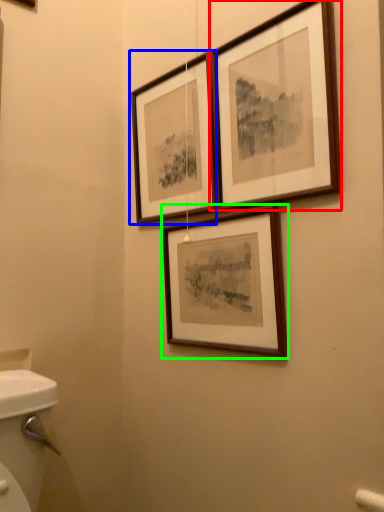
Question: Which is farther away from picture frame (highlighted by a red box)? picture frame (highlighted by a blue box) or picture frame (highlighted by a green box)?

Choices:
 (A) picture frame
 (B) picture frame

Answer: (B)